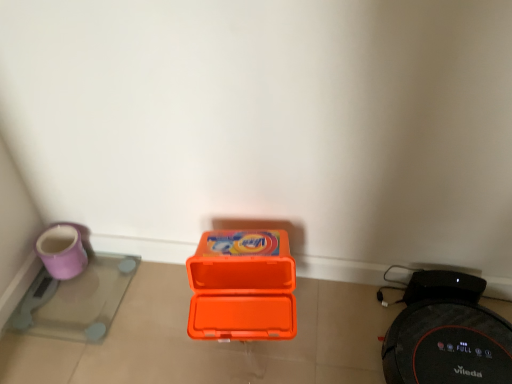
Question: Could you tell me if orange plastic box at center is facing purple glossy scale at lower left, the first appliance viewed from the left?

Choices:
 (A) yes
 (B) no

Answer: (B)

Question: Is purple glossy scale at lower left, the second appliance when ordered from right to left, at the back of orange plastic box at center?

Choices:
 (A) no
 (B) yes

Answer: (A)

Question: Is orange plastic box at center positioned in front of purple glossy scale at lower left, the second appliance when ordered from right to left?

Choices:
 (A) yes
 (B) no

Answer: (A)

Question: Is orange plastic box at center smaller than purple glossy scale at lower left, the second appliance when ordered from right to left?

Choices:
 (A) no
 (B) yes

Answer: (A)

Question: Considering the relative sizes of orange plastic box at center and purple glossy scale at lower left, the second appliance when ordered from right to left, in the image provided, is orange plastic box at center thinner than purple glossy scale at lower left, the second appliance when ordered from right to left,?

Choices:
 (A) no
 (B) yes

Answer: (B)

Question: From the image's perspective, relative to black rubber robot vacuum cleaner at lower right, marked as the 1th appliance in a right-to-left arrangement, is purple glossy scale at lower left, the first appliance viewed from the left, above or below?

Choices:
 (A) below
 (B) above

Answer: (B)

Question: Considering their positions, is purple glossy scale at lower left, the first appliance viewed from the left, located in front of or behind black rubber robot vacuum cleaner at lower right, the second appliance in the left-to-right sequence?

Choices:
 (A) front
 (B) behind

Answer: (B)

Question: Considering the positions of purple glossy scale at lower left, the second appliance when ordered from right to left, and black rubber robot vacuum cleaner at lower right, marked as the 1th appliance in a right-to-left arrangement, in the image, is purple glossy scale at lower left, the second appliance when ordered from right to left, taller or shorter than black rubber robot vacuum cleaner at lower right, marked as the 1th appliance in a right-to-left arrangement,?

Choices:
 (A) short
 (B) tall

Answer: (A)

Question: Is point (12, 317) closer or farther from the camera than point (395, 354)?

Choices:
 (A) farther
 (B) closer

Answer: (A)

Question: From their relative heights in the image, would you say orange plastic box at center is taller or shorter than purple glossy scale at lower left, the first appliance viewed from the left?

Choices:
 (A) short
 (B) tall

Answer: (B)

Question: Is orange plastic box at center in front of or behind purple glossy scale at lower left, the second appliance when ordered from right to left, in the image?

Choices:
 (A) front
 (B) behind

Answer: (A)

Question: Considering the positions of orange plastic box at center and purple glossy scale at lower left, the first appliance viewed from the left, in the image, is orange plastic box at center wider or thinner than purple glossy scale at lower left, the first appliance viewed from the left,?

Choices:
 (A) thin
 (B) wide

Answer: (A)

Question: Would you say orange plastic box at center is inside or outside purple glossy scale at lower left, the second appliance when ordered from right to left?

Choices:
 (A) outside
 (B) inside

Answer: (A)

Question: Would you say black rubber robot vacuum cleaner at lower right, the second appliance in the left-to-right sequence, is inside or outside purple glossy scale at lower left, the first appliance viewed from the left?

Choices:
 (A) inside
 (B) outside

Answer: (B)

Question: Does point (433, 296) appear closer or farther from the camera than point (39, 292)?

Choices:
 (A) closer
 (B) farther

Answer: (A)